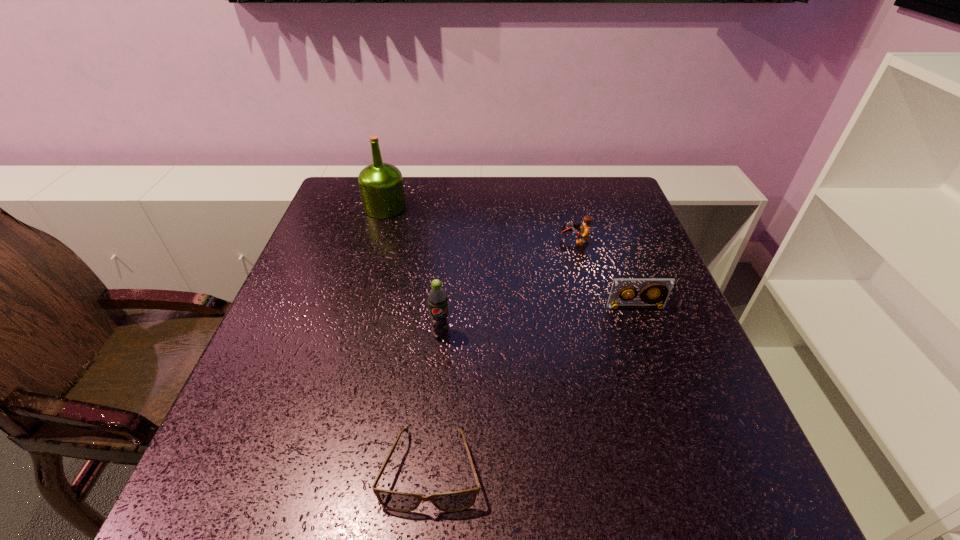
At what (x,y) coordinates should I click in order to perform the action: click on olive oil. Please return your answer as a coordinate pair (x, y). Image resolution: width=960 pixels, height=540 pixels. Looking at the image, I should click on (381, 186).

The height and width of the screenshot is (540, 960). Identify the location of the tallest object. (381, 186).

I want to click on the fourth shortest object, so click(x=437, y=297).

Where is `the fourth farthest object`? the fourth farthest object is located at coordinates (437, 297).

The image size is (960, 540). In order to click on Lego in this screenshot , I will do `click(585, 228)`.

The image size is (960, 540). Identify the location of the third farthest object. (662, 288).

This screenshot has width=960, height=540. Identify the location of the nearest object. (456, 501).

Find the location of a particular element. This screenshot has height=540, width=960. sunglasses is located at coordinates pos(456,501).

Locate an element on the screen. Image resolution: width=960 pixels, height=540 pixels. vacant region located 0.050m on the right of the olive oil is located at coordinates (423, 207).

In order to click on blank space located 0.260m on the front label of the soda in this screenshot , I will do click(429, 464).